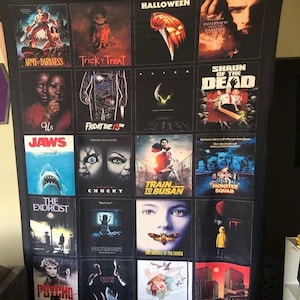
The image size is (300, 300). I want to click on psycho poster, so click(x=56, y=289).